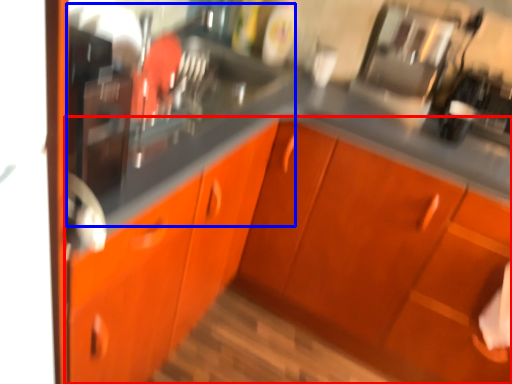
Question: Which of the following is the farthest to the observer, cabinetry (highlighted by a red box) or sink (highlighted by a blue box)?

Choices:
 (A) cabinetry
 (B) sink

Answer: (B)